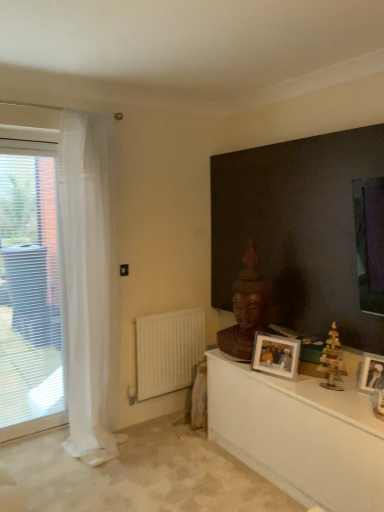
Locate an element on the screen. The image size is (384, 512). vacant space to the right of white sheer curtain at left is located at coordinates (155, 451).